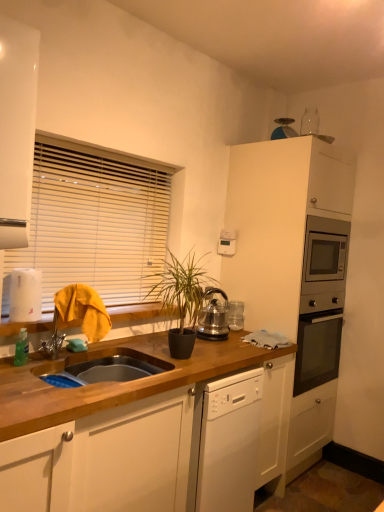
Question: Is wooden at left positioned with its back to white glossy cabinet at upper left, placed as the second cabinetry when sorted from right to left?

Choices:
 (A) no
 (B) yes

Answer: (A)

Question: Can you confirm if wooden at left is wider than white glossy cabinet at upper left, placed as the second cabinetry when sorted from right to left?

Choices:
 (A) yes
 (B) no

Answer: (A)

Question: From a real-world perspective, is wooden at left positioned over white glossy cabinet at upper left, acting as the second cabinetry starting from the back, based on gravity?

Choices:
 (A) yes
 (B) no

Answer: (B)

Question: From a real-world perspective, is wooden at left located beneath white glossy cabinet at upper left, marked as the first cabinetry in a front-to-back arrangement?

Choices:
 (A) no
 (B) yes

Answer: (B)

Question: Can you confirm if wooden at left is bigger than white glossy cabinet at upper left, acting as the second cabinetry starting from the back?

Choices:
 (A) no
 (B) yes

Answer: (B)

Question: In the image, is white matte cabinet at upper right, which is the 2th cabinetry in left-to-right order, positioned in front of or behind wooden blinds at upper left?

Choices:
 (A) behind
 (B) front

Answer: (A)

Question: Choose the correct answer: Is white matte cabinet at upper right, positioned as the 2th cabinetry in front-to-back order, inside wooden blinds at upper left or outside it?

Choices:
 (A) outside
 (B) inside

Answer: (A)

Question: Is white matte cabinet at upper right, the 1th cabinetry viewed from the back, to the left or to the right of wooden blinds at upper left in the image?

Choices:
 (A) right
 (B) left

Answer: (A)

Question: From a real-world perspective, is white matte cabinet at upper right, positioned as the 2th cabinetry in front-to-back order, physically located above or below wooden blinds at upper left?

Choices:
 (A) below
 (B) above

Answer: (A)

Question: Would you say wooden at left is inside or outside polished stainless steel kettle at center?

Choices:
 (A) inside
 (B) outside

Answer: (B)

Question: Is wooden at left in front of or behind polished stainless steel kettle at center in the image?

Choices:
 (A) front
 (B) behind

Answer: (A)

Question: From a real-world perspective, is wooden at left above or below polished stainless steel kettle at center?

Choices:
 (A) below
 (B) above

Answer: (A)

Question: From the image's perspective, relative to polished stainless steel kettle at center, is wooden at left above or below?

Choices:
 (A) below
 (B) above

Answer: (A)

Question: In terms of width, does wooden at left look wider or thinner when compared to white glossy cabinet at upper left, acting as the second cabinetry starting from the back?

Choices:
 (A) thin
 (B) wide

Answer: (B)

Question: From a real-world perspective, is wooden at left above or below white glossy cabinet at upper left, placed as the second cabinetry when sorted from right to left?

Choices:
 (A) below
 (B) above

Answer: (A)